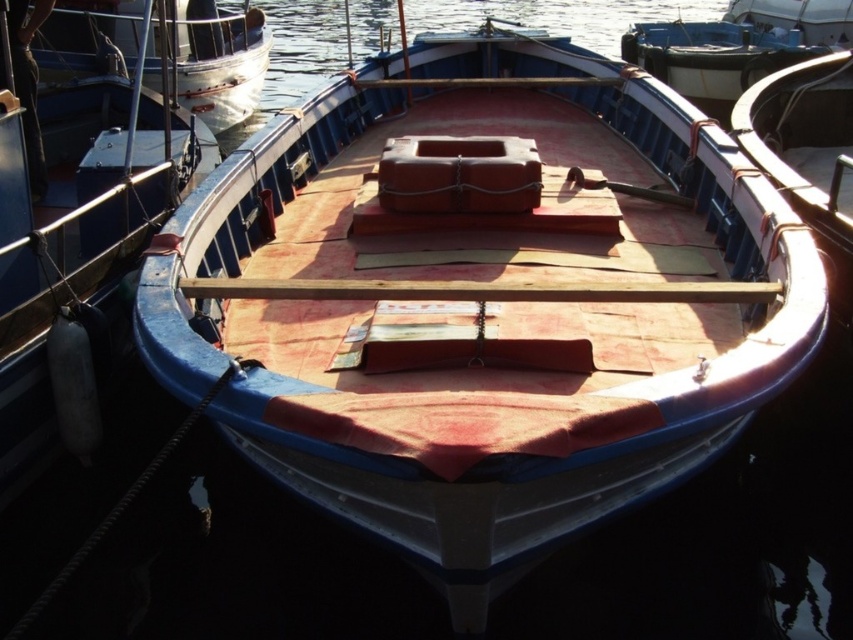
You are standing on the dock and see the clear water at center and the brushed metal boat at upper left. Which object is higher in the image?

The clear water at center is much taller than the brushed metal boat at upper left, so the clear water at center is higher in the image.

You are standing on the dock and want to take a photo of the boat. The camera you have can only focus on objects within 3 meters. Is the point at coordinates point [3,500] within the camera focus range?

The point point [3,500] is 3.85 meters away from the camera, which is beyond the 3 meter focus range. The camera cannot focus on it.